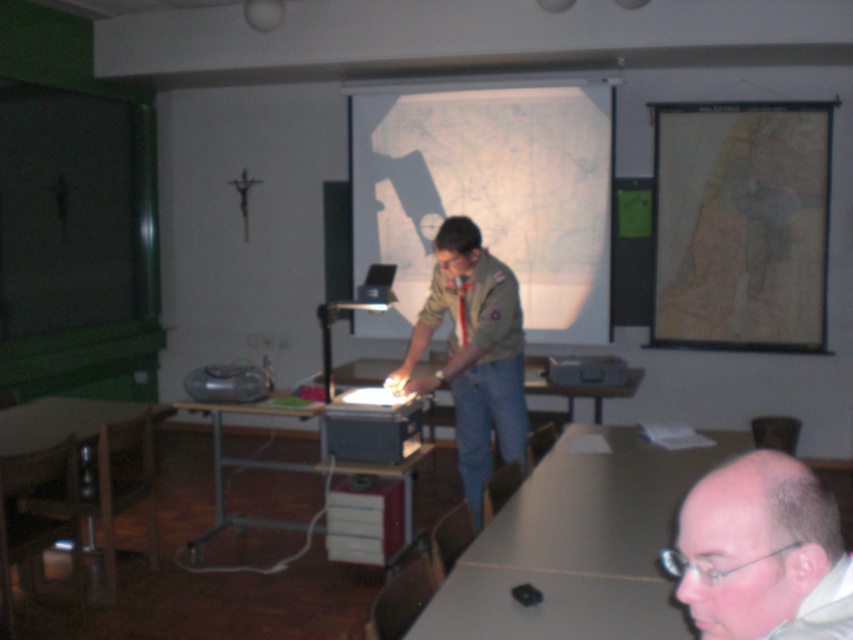
Does point (746, 536) come farther from viewer compared to point (140, 404)?

No.

Does bald head at lower right appear on the left side of wooden table at lower left?

No, bald head at lower right is not to the left of wooden table at lower left.

The width and height of the screenshot is (853, 640). In order to click on bald head at lower right in this screenshot , I will do `click(753, 545)`.

Is point (432, 374) positioned before point (3, 413)?

That is False.

From the picture: Is green uniform at center taller than wooden table at lower left?

Correct, green uniform at center is much taller as wooden table at lower left.

Image resolution: width=853 pixels, height=640 pixels. What are the coordinates of `green uniform at center` in the screenshot? It's located at (474, 353).

What are the coordinates of `green uniform at center` in the screenshot? It's located at (474, 353).

Can you confirm if bald head at lower right is thinner than metallic gray table at lower left?

Yes, bald head at lower right is thinner than metallic gray table at lower left.

This screenshot has height=640, width=853. What do you see at coordinates (753, 545) in the screenshot? I see `bald head at lower right` at bounding box center [753, 545].

What do you see at coordinates (753, 545) in the screenshot? The height and width of the screenshot is (640, 853). I see `bald head at lower right` at bounding box center [753, 545].

This screenshot has height=640, width=853. I want to click on bald head at lower right, so click(753, 545).